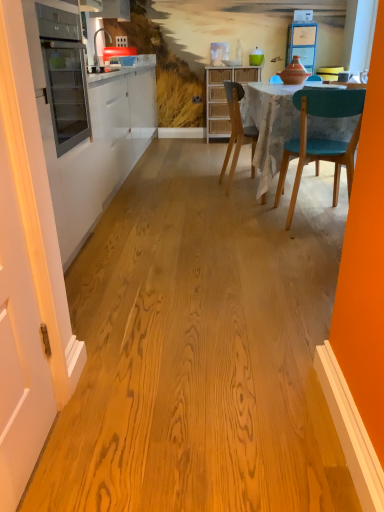
Question: Does teal glossy vase at upper center turn towards matte glass oven at left?

Choices:
 (A) yes
 (B) no

Answer: (A)

Question: Is the depth of teal glossy vase at upper center less than that of matte glass oven at left?

Choices:
 (A) no
 (B) yes

Answer: (A)

Question: From the image's perspective, is teal glossy vase at upper center on top of matte glass oven at left?

Choices:
 (A) yes
 (B) no

Answer: (A)

Question: Does teal glossy vase at upper center have a greater width compared to matte glass oven at left?

Choices:
 (A) yes
 (B) no

Answer: (B)

Question: Does teal glossy vase at upper center have a smaller size compared to matte glass oven at left?

Choices:
 (A) no
 (B) yes

Answer: (B)

Question: Does point (253, 59) appear closer or farther from the camera than point (213, 113)?

Choices:
 (A) closer
 (B) farther

Answer: (B)

Question: From a real-world perspective, relative to woven wood cabinet at center, is teal glossy vase at upper center vertically above or below?

Choices:
 (A) below
 (B) above

Answer: (B)

Question: Choose the correct answer: Is teal glossy vase at upper center inside woven wood cabinet at center or outside it?

Choices:
 (A) outside
 (B) inside

Answer: (A)

Question: From the image's perspective, is teal glossy vase at upper center above or below woven wood cabinet at center?

Choices:
 (A) below
 (B) above

Answer: (B)

Question: In terms of height, does woven wood cabinet at center look taller or shorter compared to white painted wood door at left?

Choices:
 (A) short
 (B) tall

Answer: (A)

Question: From a real-world perspective, is woven wood cabinet at center above or below white painted wood door at left?

Choices:
 (A) above
 (B) below

Answer: (B)

Question: Is woven wood cabinet at center wider or thinner than white painted wood door at left?

Choices:
 (A) wide
 (B) thin

Answer: (A)

Question: Is woven wood cabinet at center to the left or to the right of white painted wood door at left in the image?

Choices:
 (A) left
 (B) right

Answer: (B)

Question: Looking at their shapes, would you say teal glossy vase at upper center is wider or thinner than matte gray chair at center?

Choices:
 (A) thin
 (B) wide

Answer: (A)

Question: In terms of height, does teal glossy vase at upper center look taller or shorter compared to matte gray chair at center?

Choices:
 (A) short
 (B) tall

Answer: (A)